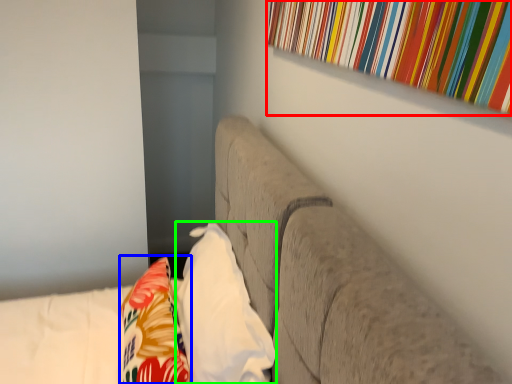
Question: Which is farther away from curtain (highlighted by a red box)? throw pillow (highlighted by a blue box) or pillow (highlighted by a green box)?

Choices:
 (A) throw pillow
 (B) pillow

Answer: (A)